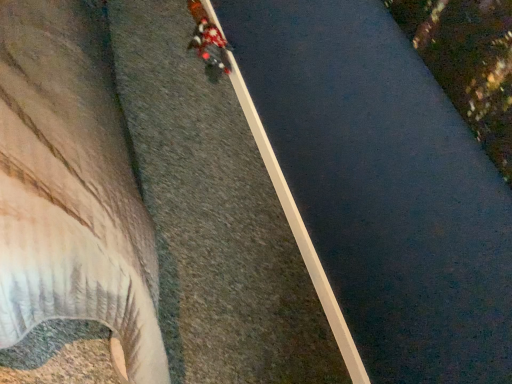
Where is `free location in front of smooth concrete waterway at center`? This screenshot has width=512, height=384. free location in front of smooth concrete waterway at center is located at coordinates (227, 235).